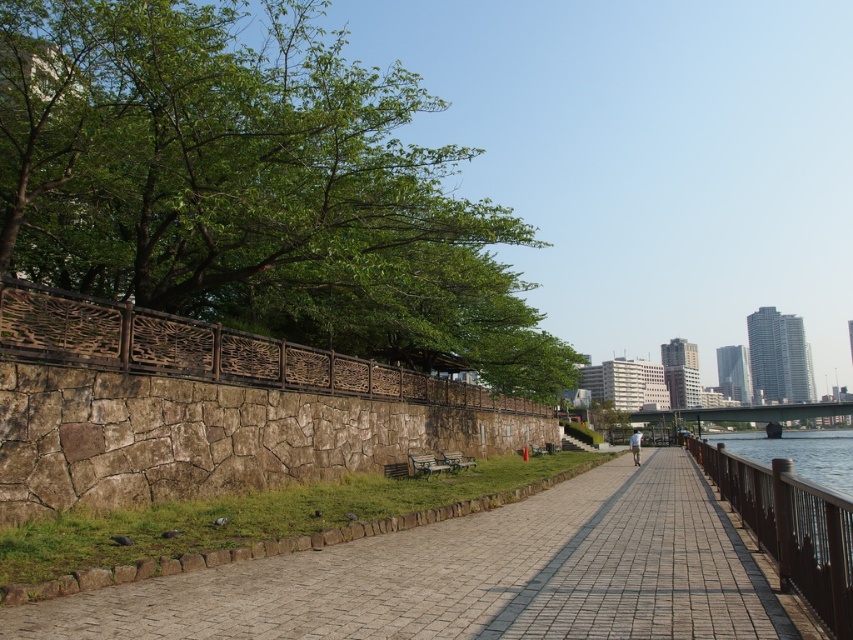
You are standing on the paved stone walkway at center and want to reach the brown wooden railing at right. Which direction should you move to get closer to the railing?

You should move forward because the paved stone walkway at center is further to the viewer than the brown wooden railing at right, so moving forward along the walkway will bring you closer to the railing.

You are a hiker who wants to take a photo of the brick paved walkway at center and the green leafy tree at upper left from the riverside. Since you want both objects in the frame, which object should you position yourself closer to?

To include both the brick paved walkway at center and the green leafy tree at upper left in the photo, you should position yourself closer to the green leafy tree at upper left. This is because the brick paved walkway at center is behind the green leafy tree at upper left, so moving closer to the tree will help ensure both are visible in the frame without the walkway being obscured.